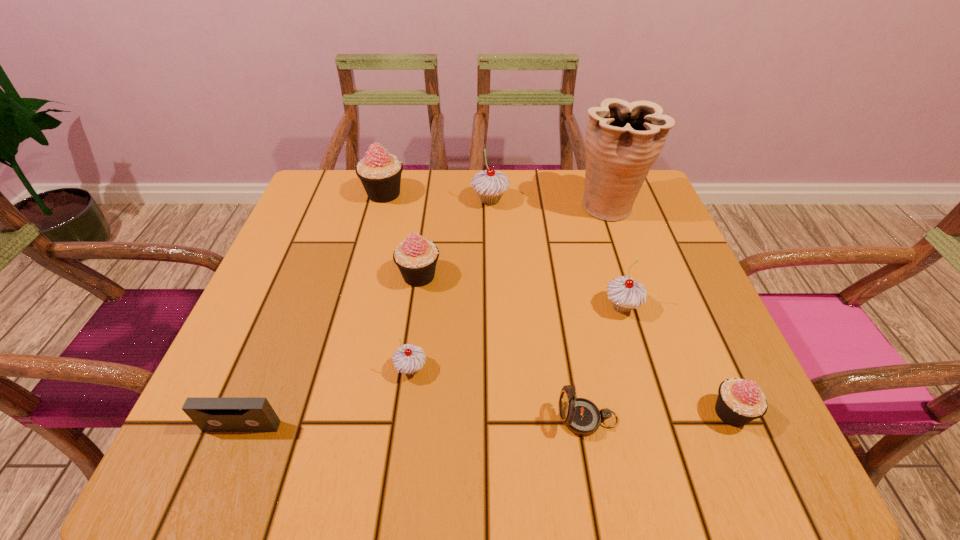
At what (x,y) coordinates should I click in order to perform the action: click on videotape that is at the near edge. Please return your answer as a coordinate pair (x, y). Looking at the image, I should click on (211, 414).

Locate an element on the screen. The height and width of the screenshot is (540, 960). cupcake that is at the left edge is located at coordinates (380, 173).

You are a GUI agent. You are given a task and a screenshot of the screen. Output one action in this format:
    pyautogui.click(x=<x>, y=<y>)
    Task: Click on the videotape present at the left edge
    This screenshot has width=960, height=540.
    Given the screenshot: What is the action you would take?
    pyautogui.click(x=211, y=414)

Find the location of a particular element. The width and height of the screenshot is (960, 540). urn that is positioned at the right edge is located at coordinates (623, 140).

Find the location of `object that is at the far left corner`. object that is at the far left corner is located at coordinates (380, 173).

The height and width of the screenshot is (540, 960). What are the coordinates of `object positioned at the near left corner` in the screenshot? It's located at (211, 414).

The image size is (960, 540). I want to click on object positioned at the far right corner, so click(623, 140).

Locate an element on the screen. The height and width of the screenshot is (540, 960). object that is at the near right corner is located at coordinates (739, 401).

Where is `blank space at the far edge`? blank space at the far edge is located at coordinates (414, 208).

In the image, there is a desktop. Where is `vacant space at the near edge`? vacant space at the near edge is located at coordinates (453, 462).